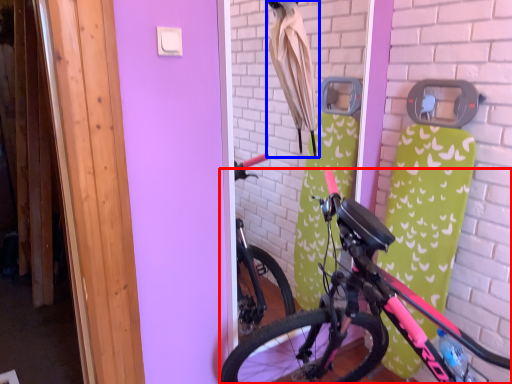
Question: Which object appears farthest to the camera in this image, bicycle (highlighted by a red box) or umbrella (highlighted by a blue box)?

Choices:
 (A) bicycle
 (B) umbrella

Answer: (B)